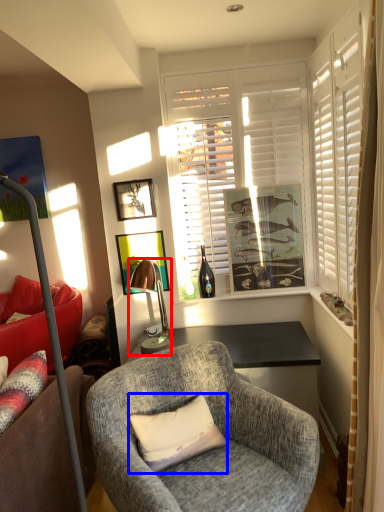
Question: Which object is closer to the camera taking this photo, lamp (highlighted by a red box) or pillow (highlighted by a blue box)?

Choices:
 (A) lamp
 (B) pillow

Answer: (B)